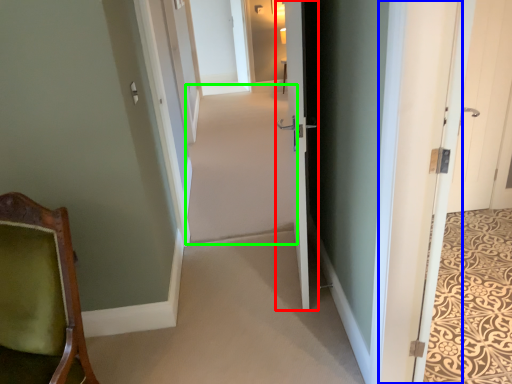
Question: Considering the real-world distances, which object is farthest from door (highlighted by a red box)? door (highlighted by a blue box) or plain (highlighted by a green box)?

Choices:
 (A) door
 (B) plain

Answer: (B)